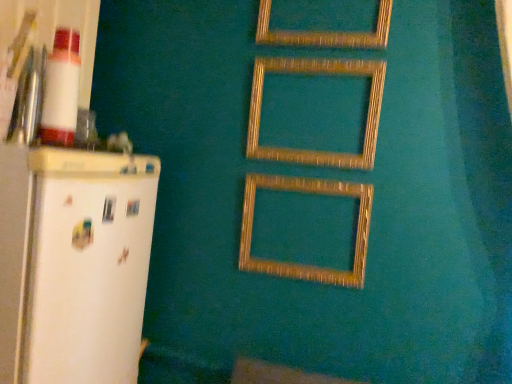
This screenshot has width=512, height=384. I want to click on gold textured frame at upper center, which is the 3th picture frame in bottom-to-top order, so click(x=324, y=31).

What do you see at coordinates (314, 75) in the screenshot? I see `wooden frame at center, placed as the 2th picture frame when sorted from top to bottom` at bounding box center [314, 75].

I want to click on white matte refrigerator at left, so click(74, 265).

Can gold textured frame at upper center, which is the 3th picture frame in bottom-to-top order, be found inside gold textured picture frame at center, the first picture frame ordered from the bottom?

No, gold textured frame at upper center, which is the 3th picture frame in bottom-to-top order, is not a part of gold textured picture frame at center, the first picture frame ordered from the bottom.

Consider the image. From a real-world perspective, is gold textured picture frame at center, the 3th picture frame when ordered from top to bottom, under gold textured frame at upper center, the 1th picture frame when ordered from top to bottom?

Correct, in the physical world, gold textured picture frame at center, the 3th picture frame when ordered from top to bottom, is lower than gold textured frame at upper center, the 1th picture frame when ordered from top to bottom.

Is the position of gold textured picture frame at center, the first picture frame ordered from the bottom, less distant than that of gold textured frame at upper center, which is the 3th picture frame in bottom-to-top order?

No, the depth of gold textured picture frame at center, the first picture frame ordered from the bottom, is greater than that of gold textured frame at upper center, which is the 3th picture frame in bottom-to-top order.

Considering the sizes of gold textured picture frame at center, the first picture frame ordered from the bottom, and gold textured frame at upper center, the 1th picture frame when ordered from top to bottom, in the image, is gold textured picture frame at center, the first picture frame ordered from the bottom, bigger or smaller than gold textured frame at upper center, the 1th picture frame when ordered from top to bottom,?

Clearly, gold textured picture frame at center, the first picture frame ordered from the bottom, is smaller in size than gold textured frame at upper center, the 1th picture frame when ordered from top to bottom.

Between wooden frame at center, placed as the 2th picture frame when sorted from top to bottom, and white matte refrigerator at left, which one has more height?

With more height is white matte refrigerator at left.

From the picture: Could white matte refrigerator at left be considered to be inside wooden frame at center, which is counted as the second picture frame, starting from the bottom?

No, white matte refrigerator at left is not a part of wooden frame at center, which is counted as the second picture frame, starting from the bottom.

Is wooden frame at center, placed as the 2th picture frame when sorted from top to bottom, beside white matte refrigerator at left?

There is a gap between wooden frame at center, placed as the 2th picture frame when sorted from top to bottom, and white matte refrigerator at left.

Is point (258, 178) behind point (128, 262)?

Yes, it is behind point (128, 262).

Which object is positioned more to the left, gold textured picture frame at center, the first picture frame ordered from the bottom, or white matte refrigerator at left?

From the viewer's perspective, white matte refrigerator at left appears more on the left side.

From a real-world perspective, is gold textured picture frame at center, the first picture frame ordered from the bottom, above or below white matte refrigerator at left?

From a real-world perspective, gold textured picture frame at center, the first picture frame ordered from the bottom, is physically above white matte refrigerator at left.

Which is further, (61, 339) or (297, 73)?

The point (297, 73) is farther from the camera.

From a real-world perspective, who is located lower, white matte refrigerator at left or wooden frame at center, which is counted as the second picture frame, starting from the bottom?

In real-world perspective, white matte refrigerator at left is lower.

Is white matte refrigerator at left inside or outside of wooden frame at center, which is counted as the second picture frame, starting from the bottom?

white matte refrigerator at left is not enclosed by wooden frame at center, which is counted as the second picture frame, starting from the bottom.

Which is behind, white matte refrigerator at left or wooden frame at center, which is counted as the second picture frame, starting from the bottom?

wooden frame at center, which is counted as the second picture frame, starting from the bottom, is further from the camera.

Is wooden frame at center, placed as the 2th picture frame when sorted from top to bottom, next to gold textured picture frame at center, the first picture frame ordered from the bottom?

No, wooden frame at center, placed as the 2th picture frame when sorted from top to bottom, is not with gold textured picture frame at center, the first picture frame ordered from the bottom.

From a real-world perspective, is wooden frame at center, placed as the 2th picture frame when sorted from top to bottom, positioned above or below gold textured picture frame at center, the 3th picture frame when ordered from top to bottom?

wooden frame at center, placed as the 2th picture frame when sorted from top to bottom, is above gold textured picture frame at center, the 3th picture frame when ordered from top to bottom.

From the image's perspective, between wooden frame at center, placed as the 2th picture frame when sorted from top to bottom, and gold textured picture frame at center, the 3th picture frame when ordered from top to bottom, who is located below?

gold textured picture frame at center, the 3th picture frame when ordered from top to bottom, is shown below in the image.

The width and height of the screenshot is (512, 384). Find the location of `picture frame behind the wooden frame at center, placed as the 2th picture frame when sorted from top to bottom`. picture frame behind the wooden frame at center, placed as the 2th picture frame when sorted from top to bottom is located at coordinates (298, 264).

Are white matte refrigerator at left and gold textured picture frame at center, the 3th picture frame when ordered from top to bottom, beside each other?

→ white matte refrigerator at left and gold textured picture frame at center, the 3th picture frame when ordered from top to bottom, are not in contact.

From a real-world perspective, which object stands above the other?

gold textured picture frame at center, the first picture frame ordered from the bottom, from a real-world perspective.

Where is `fridge below the gold textured picture frame at center, the 3th picture frame when ordered from top to bottom (from a real-world perspective)`? This screenshot has width=512, height=384. fridge below the gold textured picture frame at center, the 3th picture frame when ordered from top to bottom (from a real-world perspective) is located at coordinates (74, 265).

Can you confirm if gold textured frame at upper center, the 1th picture frame when ordered from top to bottom, is taller than gold textured picture frame at center, the first picture frame ordered from the bottom?

Indeed, gold textured frame at upper center, the 1th picture frame when ordered from top to bottom, has a greater height compared to gold textured picture frame at center, the first picture frame ordered from the bottom.

What's the angular difference between gold textured frame at upper center, which is the 3th picture frame in bottom-to-top order, and gold textured picture frame at center, the 3th picture frame when ordered from top to bottom,'s facing directions?

The angular difference between gold textured frame at upper center, which is the 3th picture frame in bottom-to-top order, and gold textured picture frame at center, the 3th picture frame when ordered from top to bottom, is 0.692 degrees.

Locate an element on the screen. the 2nd picture frame counting from the left side of the gold textured frame at upper center, which is the 3th picture frame in bottom-to-top order is located at coordinates (298, 264).

Would you consider gold textured frame at upper center, which is the 3th picture frame in bottom-to-top order, to be distant from gold textured picture frame at center, the first picture frame ordered from the bottom?

gold textured frame at upper center, which is the 3th picture frame in bottom-to-top order, is actually quite close to gold textured picture frame at center, the first picture frame ordered from the bottom.

Locate an element on the screen. the 2nd picture frame counting from the left of the gold textured frame at upper center, the 1th picture frame when ordered from top to bottom is located at coordinates tap(298, 264).

Starting from the white matte refrigerator at left, which picture frame is the 2nd one behind? Please provide its 2D coordinates.

[(314, 75)]

From the image, which object appears to be farther from wooden frame at center, which is counted as the second picture frame, starting from the bottom, white matte refrigerator at left or gold textured picture frame at center, the 3th picture frame when ordered from top to bottom?

The object further to wooden frame at center, which is counted as the second picture frame, starting from the bottom, is white matte refrigerator at left.

Estimate the real-world distances between objects in this image. Which object is further from white matte refrigerator at left, wooden frame at center, placed as the 2th picture frame when sorted from top to bottom, or gold textured picture frame at center, the first picture frame ordered from the bottom?

Among the two, wooden frame at center, placed as the 2th picture frame when sorted from top to bottom, is located further to white matte refrigerator at left.

From the image, which object appears to be farther from white matte refrigerator at left, gold textured frame at upper center, the 1th picture frame when ordered from top to bottom, or wooden frame at center, placed as the 2th picture frame when sorted from top to bottom?

gold textured frame at upper center, the 1th picture frame when ordered from top to bottom, is further to white matte refrigerator at left.

From the image, which object appears to be farther from white matte refrigerator at left, gold textured picture frame at center, the first picture frame ordered from the bottom, or gold textured frame at upper center, the 1th picture frame when ordered from top to bottom?

Among the two, gold textured frame at upper center, the 1th picture frame when ordered from top to bottom, is located further to white matte refrigerator at left.

From the image, which object appears to be nearer to white matte refrigerator at left, gold textured picture frame at center, the first picture frame ordered from the bottom, or wooden frame at center, placed as the 2th picture frame when sorted from top to bottom?

gold textured picture frame at center, the first picture frame ordered from the bottom, is closer to white matte refrigerator at left.

When comparing their distances from gold textured picture frame at center, the first picture frame ordered from the bottom, does gold textured frame at upper center, which is the 3th picture frame in bottom-to-top order, or white matte refrigerator at left seem closer?

Among the two, white matte refrigerator at left is located nearer to gold textured picture frame at center, the first picture frame ordered from the bottom.

From the image, which object appears to be farther from gold textured frame at upper center, which is the 3th picture frame in bottom-to-top order, white matte refrigerator at left or gold textured picture frame at center, the 3th picture frame when ordered from top to bottom?

The object further to gold textured frame at upper center, which is the 3th picture frame in bottom-to-top order, is white matte refrigerator at left.

Considering their positions, is white matte refrigerator at left positioned further to wooden frame at center, which is counted as the second picture frame, starting from the bottom, than gold textured frame at upper center, the 1th picture frame when ordered from top to bottom?

The object further to wooden frame at center, which is counted as the second picture frame, starting from the bottom, is white matte refrigerator at left.

Locate an element on the screen. picture frame located between white matte refrigerator at left and wooden frame at center, placed as the 2th picture frame when sorted from top to bottom, in the left-right direction is located at coordinates (298, 264).

Where is `picture frame between gold textured frame at upper center, the 1th picture frame when ordered from top to bottom, and gold textured picture frame at center, the 3th picture frame when ordered from top to bottom, from top to bottom`? This screenshot has height=384, width=512. picture frame between gold textured frame at upper center, the 1th picture frame when ordered from top to bottom, and gold textured picture frame at center, the 3th picture frame when ordered from top to bottom, from top to bottom is located at coordinates (314, 75).